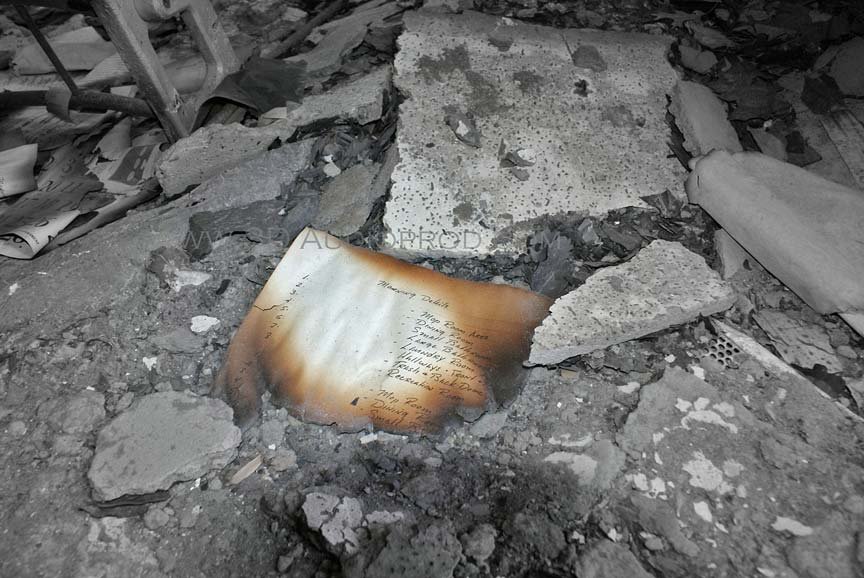
Image resolution: width=864 pixels, height=578 pixels. In order to click on recreation room in this screenshot , I will do `click(404, 379)`, `click(445, 392)`.